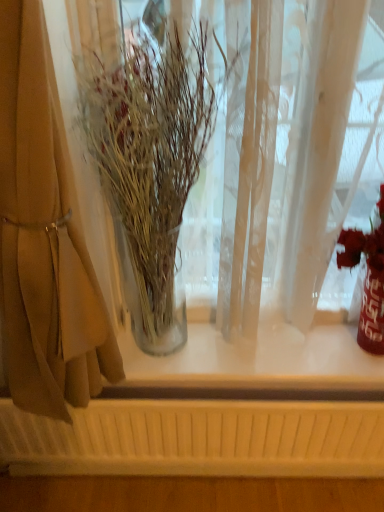
You are a GUI agent. You are given a task and a screenshot of the screen. Output one action in this format:
    pyautogui.click(x=<x>, y=<y>)
    Task: Click on the shiny metallic vase at right
    
    Given the screenshot: What is the action you would take?
    pyautogui.click(x=368, y=278)

Identify the location of shiny metallic vase at right. (368, 278).

From the image's perspective, which is below, beige fabric curtain at left or shiny metallic vase at right?

shiny metallic vase at right.

Considering the sizes of objects beige fabric curtain at left and shiny metallic vase at right in the image provided, who is thinner, beige fabric curtain at left or shiny metallic vase at right?

shiny metallic vase at right is thinner.

Is shiny metallic vase at right surrounded by beige fabric curtain at left?

No, beige fabric curtain at left does not contain shiny metallic vase at right.

Who is shorter, clear glass vase at left or beige fabric curtain at left?

Standing shorter between the two is clear glass vase at left.

Looking at this image, considering the positions of objects clear glass vase at left and beige fabric curtain at left in the image provided, who is more to the left, clear glass vase at left or beige fabric curtain at left?

beige fabric curtain at left is more to the left.

Are clear glass vase at left and beige fabric curtain at left beside each other?

clear glass vase at left and beige fabric curtain at left are clearly separated.

Is clear glass vase at left beside shiny metallic vase at right?

There is a gap between clear glass vase at left and shiny metallic vase at right.

From a real-world perspective, does clear glass vase at left sit lower than shiny metallic vase at right?

No, from a real-world perspective, clear glass vase at left is not below shiny metallic vase at right.

From the image's perspective, is clear glass vase at left over shiny metallic vase at right?

Indeed, from the image's perspective, clear glass vase at left is shown above shiny metallic vase at right.

Based on the photo, considering the sizes of objects clear glass vase at left and shiny metallic vase at right in the image provided, who is smaller, clear glass vase at left or shiny metallic vase at right?

shiny metallic vase at right.

Is shiny metallic vase at right wider or thinner than beige fabric curtain at left?

In the image, shiny metallic vase at right appears to be more narrow than beige fabric curtain at left.

Which object is further away from the camera taking this photo, shiny metallic vase at right or beige fabric curtain at left?

shiny metallic vase at right.

Consider the image. From the image's perspective, is shiny metallic vase at right located above or below beige fabric curtain at left?

From the image's perspective, shiny metallic vase at right appears below beige fabric curtain at left.

From a real-world perspective, relative to beige fabric curtain at left, is shiny metallic vase at right vertically above or below?

Clearly, from a real-world perspective, shiny metallic vase at right is below beige fabric curtain at left.

Are beige fabric curtain at left and clear glass vase at left far apart?

They are positioned close to each other.

In the scene shown: Can you confirm if beige fabric curtain at left is smaller than clear glass vase at left?

Actually, beige fabric curtain at left might be larger than clear glass vase at left.

There is a clear glass vase at left. Identify the location of curtain above it (from a real-world perspective). (44, 237).

Is clear glass vase at left inside beige fabric curtain at left?

No, clear glass vase at left is not surrounded by beige fabric curtain at left.

Is shiny metallic vase at right facing away from clear glass vase at left?

No, shiny metallic vase at right is not facing away from clear glass vase at left.

Which of these two, shiny metallic vase at right or clear glass vase at left, is wider?

Wider between the two is clear glass vase at left.

From the image's perspective, which one is positioned higher, shiny metallic vase at right or clear glass vase at left?

From the image's view, clear glass vase at left is above.

Measure the distance between shiny metallic vase at right and clear glass vase at left.

shiny metallic vase at right and clear glass vase at left are 20.41 inches apart from each other.

Where is `curtain that appears above the shiny metallic vase at right (from a real-world perspective)`? The width and height of the screenshot is (384, 512). curtain that appears above the shiny metallic vase at right (from a real-world perspective) is located at coordinates tap(44, 237).

You are a GUI agent. You are given a task and a screenshot of the screen. Output one action in this format:
    pyautogui.click(x=<x>, y=<y>)
    Task: Click on the houseplant that appears behind the beige fabric curtain at left
    
    Given the screenshot: What is the action you would take?
    pyautogui.click(x=150, y=166)

Looking at the image, which one is located closer to clear glass vase at left, shiny metallic vase at right or beige fabric curtain at left?

beige fabric curtain at left is closer to clear glass vase at left.

Looking at the image, which one is located closer to shiny metallic vase at right, clear glass vase at left or beige fabric curtain at left?

The object closer to shiny metallic vase at right is clear glass vase at left.

Which object lies nearer to the anchor point beige fabric curtain at left, shiny metallic vase at right or clear glass vase at left?

The object closer to beige fabric curtain at left is clear glass vase at left.

Based on their spatial positions, is beige fabric curtain at left or clear glass vase at left further from shiny metallic vase at right?

The object further to shiny metallic vase at right is beige fabric curtain at left.

Considering their positions, is beige fabric curtain at left positioned closer to clear glass vase at left than shiny metallic vase at right?

Among the two, beige fabric curtain at left is located nearer to clear glass vase at left.

From the image, which object appears to be farther from beige fabric curtain at left, clear glass vase at left or shiny metallic vase at right?

shiny metallic vase at right lies further to beige fabric curtain at left than the other object.

Identify the location of houseplant between beige fabric curtain at left and shiny metallic vase at right. Image resolution: width=384 pixels, height=512 pixels. (150, 166).